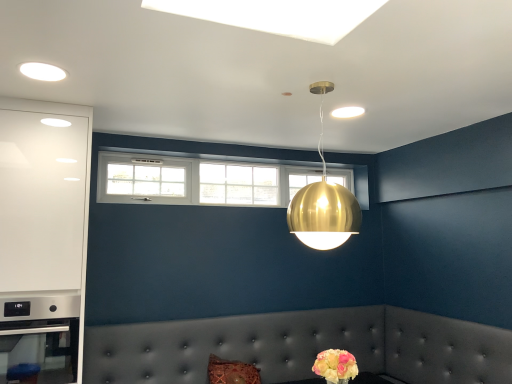
Question: Is white glass window at upper center next to pastel yellow bouquet at lower right and touching it?

Choices:
 (A) no
 (B) yes

Answer: (A)

Question: From a real-world perspective, is white glass window at upper center on top of pastel yellow bouquet at lower right?

Choices:
 (A) no
 (B) yes

Answer: (B)

Question: Is white glass window at upper center surrounding pastel yellow bouquet at lower right?

Choices:
 (A) yes
 (B) no

Answer: (B)

Question: Is white glass window at upper center not within pastel yellow bouquet at lower right?

Choices:
 (A) yes
 (B) no

Answer: (A)

Question: Does white glass window at upper center have a greater width compared to pastel yellow bouquet at lower right?

Choices:
 (A) no
 (B) yes

Answer: (A)

Question: Does white glass window at upper center have a lesser height compared to pastel yellow bouquet at lower right?

Choices:
 (A) yes
 (B) no

Answer: (B)

Question: Is satin silver oven at lower left outside of white glass window at upper center?

Choices:
 (A) no
 (B) yes

Answer: (B)

Question: Considering the relative sizes of satin silver oven at lower left and white glass window at upper center in the image provided, is satin silver oven at lower left thinner than white glass window at upper center?

Choices:
 (A) no
 (B) yes

Answer: (A)

Question: Considering the relative positions of satin silver oven at lower left and white glass window at upper center in the image provided, is satin silver oven at lower left to the left of white glass window at upper center from the viewer's perspective?

Choices:
 (A) yes
 (B) no

Answer: (A)

Question: Are satin silver oven at lower left and white glass window at upper center far apart?

Choices:
 (A) no
 (B) yes

Answer: (B)

Question: From the image's perspective, is satin silver oven at lower left on top of white glass window at upper center?

Choices:
 (A) yes
 (B) no

Answer: (B)

Question: From a real-world perspective, does satin silver oven at lower left sit lower than white glass window at upper center?

Choices:
 (A) no
 (B) yes

Answer: (B)

Question: Does tufted leather couch at lower center have a lesser width compared to gold metallic sphere at upper center?

Choices:
 (A) no
 (B) yes

Answer: (A)